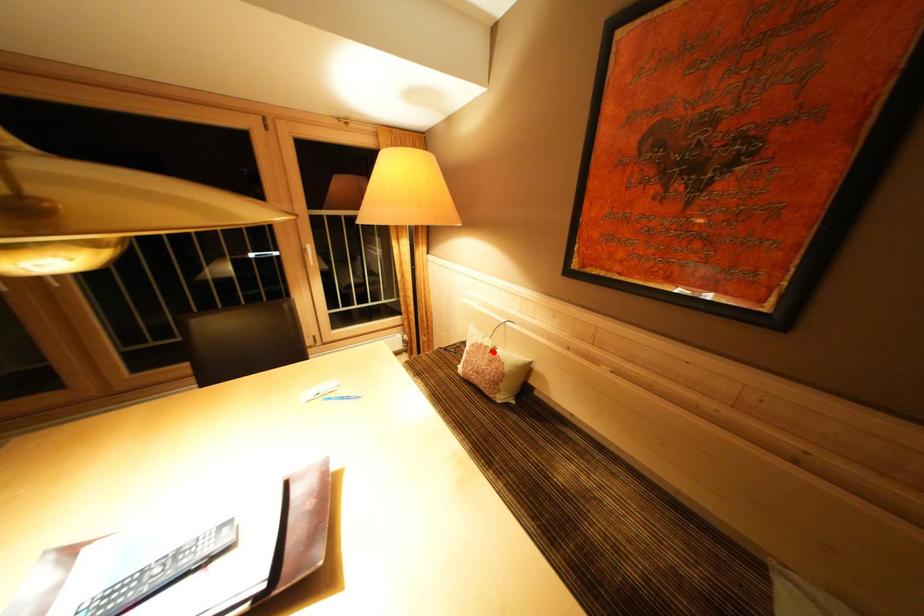
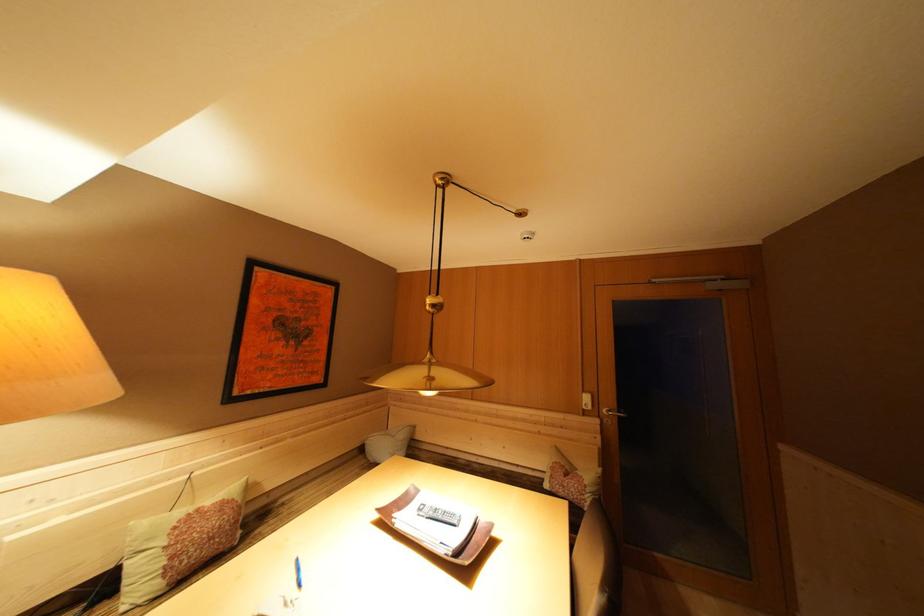
Locate, in the second image, the point that corresponds to the highlighted location in the first image.

(204, 515)